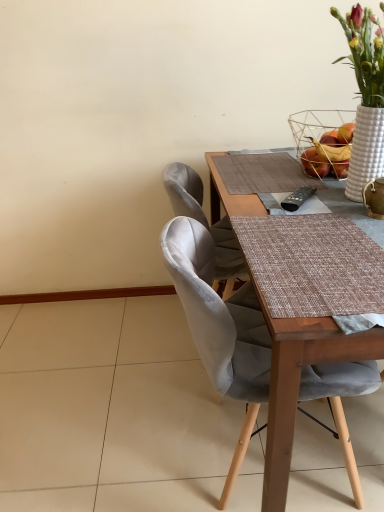
Question: From a real-world perspective, is satin grey chair at center below white textured basket at upper right?

Choices:
 (A) no
 (B) yes

Answer: (B)

Question: Is satin grey chair at center bigger than white textured basket at upper right?

Choices:
 (A) yes
 (B) no

Answer: (A)

Question: From the image's perspective, is satin grey chair at center on white textured basket at upper right?

Choices:
 (A) yes
 (B) no

Answer: (B)

Question: Considering the relative positions of satin grey chair at center and white textured basket at upper right in the image provided, is satin grey chair at center to the left of white textured basket at upper right from the viewer's perspective?

Choices:
 (A) yes
 (B) no

Answer: (A)

Question: Considering the relative sizes of satin grey chair at center and white textured basket at upper right in the image provided, is satin grey chair at center shorter than white textured basket at upper right?

Choices:
 (A) yes
 (B) no

Answer: (B)

Question: Is satin grey chair at center smaller than white textured basket at upper right?

Choices:
 (A) no
 (B) yes

Answer: (A)

Question: Can you confirm if white textured basket at upper right is thinner than satin grey chair at center?

Choices:
 (A) yes
 (B) no

Answer: (A)

Question: Is white textured basket at upper right directly adjacent to satin grey chair at center?

Choices:
 (A) yes
 (B) no

Answer: (B)

Question: From the image's perspective, is white textured basket at upper right located above satin grey chair at center?

Choices:
 (A) yes
 (B) no

Answer: (A)

Question: Is white textured basket at upper right positioned with its back to satin grey chair at center?

Choices:
 (A) no
 (B) yes

Answer: (A)

Question: Is white textured basket at upper right surrounding satin grey chair at center?

Choices:
 (A) yes
 (B) no

Answer: (B)

Question: Is white textured basket at upper right positioned behind satin grey chair at center?

Choices:
 (A) yes
 (B) no

Answer: (A)

Question: Is white textured basket at upper right inside or outside of satin grey chair at center?

Choices:
 (A) outside
 (B) inside

Answer: (A)